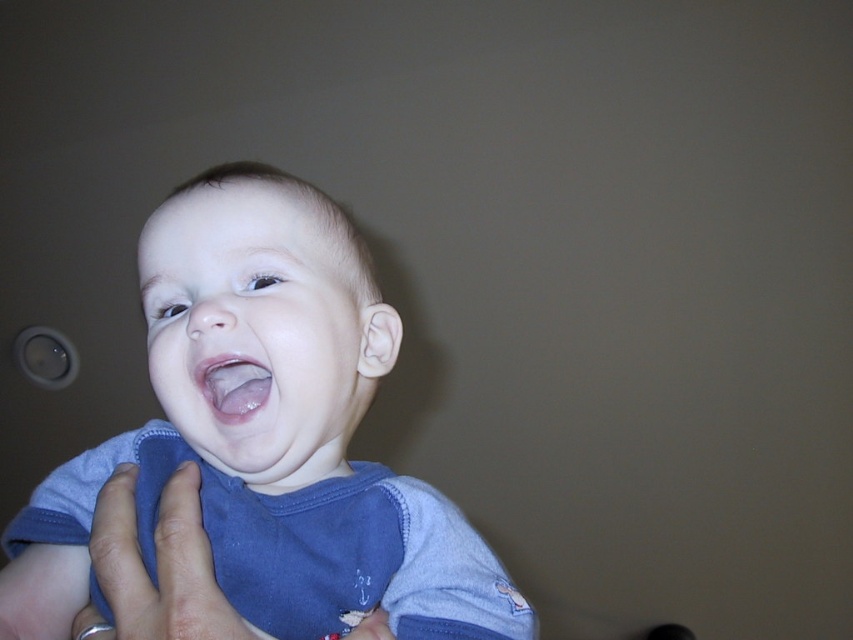
Can you confirm if blue soft fabric baby at center is positioned to the right of skin/softhand at center?

No, blue soft fabric baby at center is not to the right of skin/softhand at center.

In the scene shown: Who is more forward, (281, 362) or (107, 634)?

Point (281, 362) is in front.

Locate an element on the screen. Image resolution: width=853 pixels, height=640 pixels. blue soft fabric baby at center is located at coordinates (267, 436).

Is skin/softhand at center to the right of pink glossy lips at center from the viewer's perspective?

No, skin/softhand at center is not to the right of pink glossy lips at center.

Is skin/softhand at center shorter than pink glossy lips at center?

Incorrect, skin/softhand at center's height does not fall short of pink glossy lips at center's.

You are a GUI agent. You are given a task and a screenshot of the screen. Output one action in this format:
    pyautogui.click(x=<x>, y=<y>)
    Task: Click on the skin/softhand at center
    This screenshot has height=640, width=853.
    Given the screenshot: What is the action you would take?
    pyautogui.click(x=160, y=564)

Looking at this image, is blue soft fabric baby at center to the right of pink glossy lips at center from the viewer's perspective?

In fact, blue soft fabric baby at center is to the left of pink glossy lips at center.

Between blue soft fabric baby at center and pink glossy lips at center, which one is positioned lower?

blue soft fabric baby at center

Describe the element at coordinates (267, 436) in the screenshot. I see `blue soft fabric baby at center` at that location.

Locate an element on the screen. Image resolution: width=853 pixels, height=640 pixels. blue soft fabric baby at center is located at coordinates 267,436.